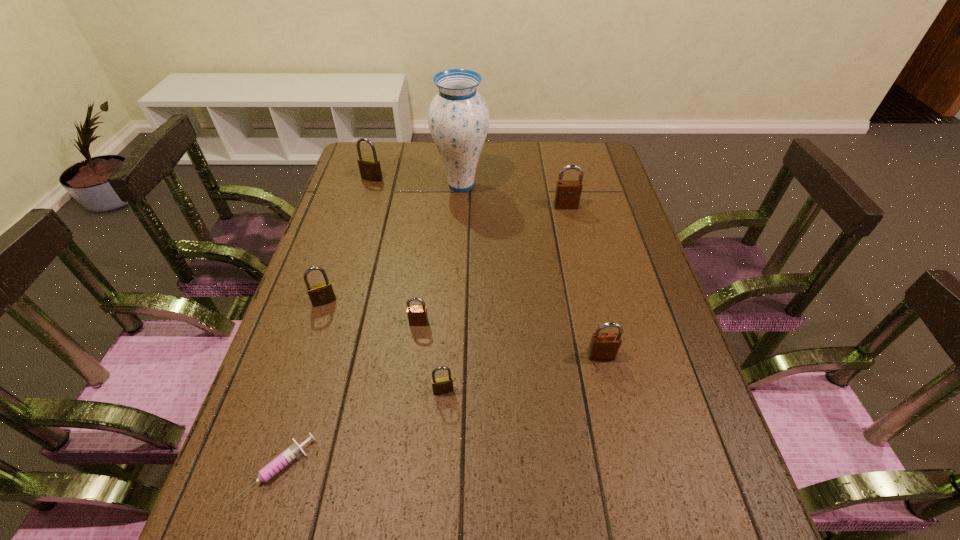
What are the coordinates of `free region at the left edge` in the screenshot? It's located at (342, 187).

Where is `free region at the right edge`? The height and width of the screenshot is (540, 960). free region at the right edge is located at coordinates (706, 424).

Locate an element on the screen. unoccupied position between the shortest object and the vase is located at coordinates (369, 328).

At what (x,y) coordinates should I click in order to perform the action: click on vacant space in between the fourth padlock from left to right and the second farthest padlock. Please return your answer as a coordinate pair (x, y). Image resolution: width=960 pixels, height=540 pixels. Looking at the image, I should click on (505, 299).

This screenshot has height=540, width=960. I want to click on vacant point located between the fifth farthest padlock and the nearest padlock, so click(522, 373).

In order to click on free spot between the second nearest padlock and the second nearest object in this screenshot , I will do `click(522, 373)`.

The height and width of the screenshot is (540, 960). Find the location of `unoccupied area between the nearest brown padlock and the farthest brass padlock`. unoccupied area between the nearest brown padlock and the farthest brass padlock is located at coordinates (487, 267).

Where is `unoccupied area between the third farthest object and the fifth farthest object`? This screenshot has width=960, height=540. unoccupied area between the third farthest object and the fifth farthest object is located at coordinates (492, 265).

Identify the location of blank region between the leftmost brown padlock and the farthest padlock. (396, 251).

You are a GUI agent. You are given a task and a screenshot of the screen. Output one action in this format:
    pyautogui.click(x=<x>, y=<y>)
    Task: Click on the vacant space that is in between the third farthest padlock and the rightmost brass padlock
    Image resolution: width=960 pixels, height=540 pixels.
    Given the screenshot: What is the action you would take?
    pyautogui.click(x=384, y=346)